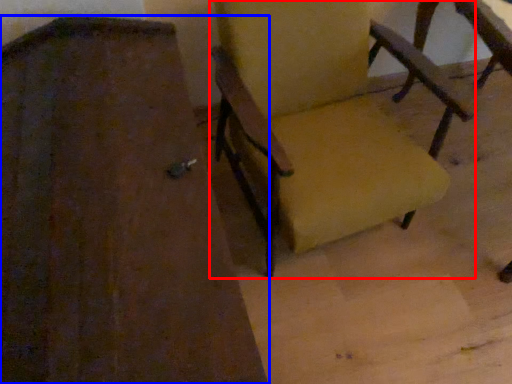
Question: Which point is closer to the camera, chair (highlighted by a red box) or chair (highlighted by a blue box)?

Choices:
 (A) chair
 (B) chair

Answer: (B)